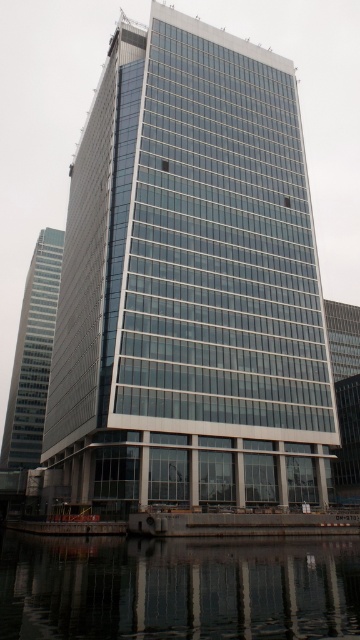
You are a city planner analyzing the skyline. Which building is wider, the glassy steel tower at center or the glassy reflective skyscraper at left?

The glassy steel tower at center is wider than the glassy reflective skyscraper at left.

You are a drone operator tasked with capturing aerial footage of the glassy reflective skyscraper at left. Your drone has a maximum flight range of 120 meters. Can your drone safely reach the transparent glass water at lower center from the skyscraper without exceeding its range?

The transparent glass water at lower center is 127.11 meters away from the glassy reflective skyscraper at left. Since the drone has a maximum range of 120 meters, it cannot safely reach the transparent glass water at lower center without exceeding its range.